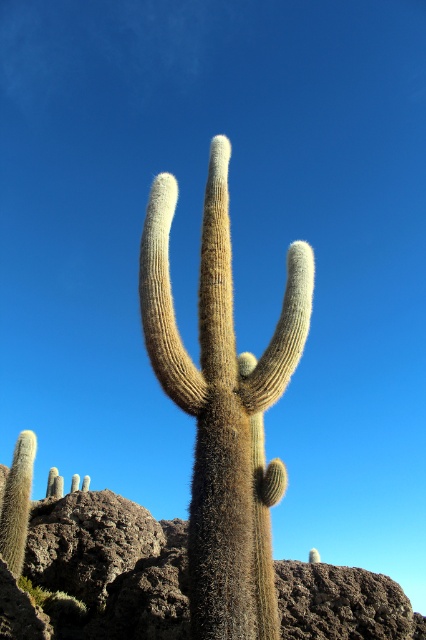
You are a photographer standing in front of the cactus scene. You want to take a photo focusing on the fuzzy brown cactus at center without the green fuzzy cactus at lower left appearing too prominent in the background. Based on their positions, can you suggest whether you should zoom in or zoom out?

The fuzzy brown cactus at center is closer to the viewer than the green fuzzy cactus at lower left. To minimize the prominence of the green fuzzy cactus at lower left in the background, you should zoom in on the fuzzy brown cactus at center. This will narrow the field of view, making the background elements smaller and less noticeable.